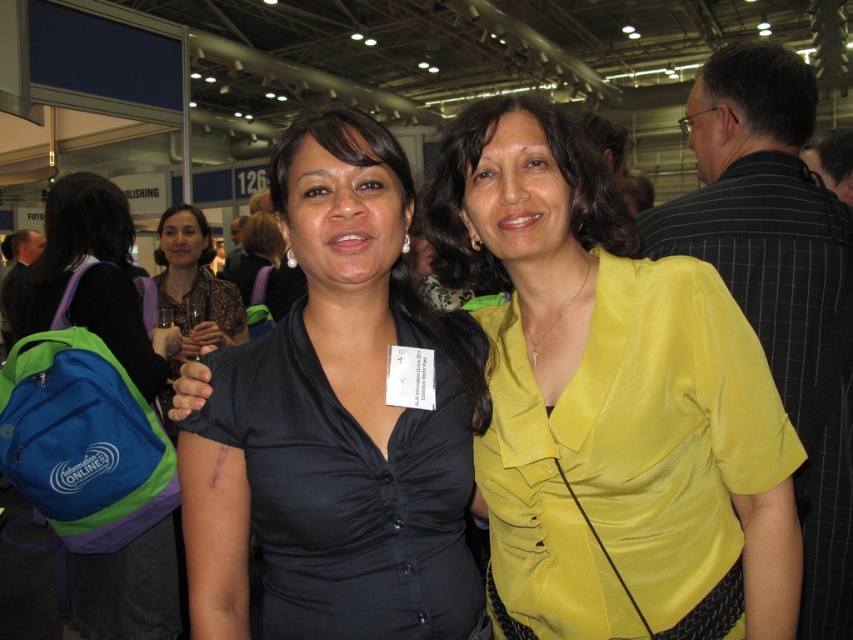
From the picture: Who is positioned more to the right, black satin blouse at center or matte black blouse at center?

From the viewer's perspective, black satin blouse at center appears more on the right side.

Who is more distant from viewer, (366, 445) or (189, 244)?

The point (189, 244) is more distant.

Between point (297, 572) and point (175, 227), which one is positioned behind?

Positioned behind is point (175, 227).

Find the location of a particular element. This screenshot has height=640, width=853. black satin blouse at center is located at coordinates (338, 422).

Does blue fabric backpack at left appear on the left side of matte black blouse at center?

Correct, you'll find blue fabric backpack at left to the left of matte black blouse at center.

Can you confirm if blue fabric backpack at left is positioned to the right of matte black blouse at center?

Incorrect, blue fabric backpack at left is not on the right side of matte black blouse at center.

What do you see at coordinates (94, 276) in the screenshot?
I see `blue fabric backpack at left` at bounding box center [94, 276].

The width and height of the screenshot is (853, 640). What are the coordinates of `blue fabric backpack at left` in the screenshot? It's located at (94, 276).

From the picture: Between yellow satin blouse at center and matte black blouse at center, which one appears on the right side from the viewer's perspective?

yellow satin blouse at center is more to the right.

Which is in front, point (712, 524) or point (189, 257)?

Positioned in front is point (712, 524).

Who is more distant from viewer, (698,547) or (180,244)?

Positioned behind is point (180,244).

You are a GUI agent. You are given a task and a screenshot of the screen. Output one action in this format:
    pyautogui.click(x=<x>, y=<y>)
    Task: Click on the yellow satin blouse at center
    
    Given the screenshot: What is the action you would take?
    pyautogui.click(x=608, y=400)